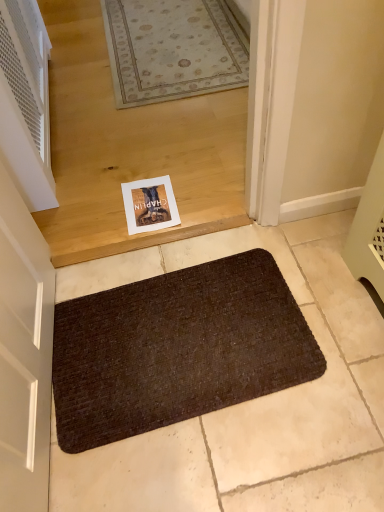
What are the coordinates of `vacant location below brown textured bath mat at lower center (from a real-world perspective)` in the screenshot? It's located at pos(173,337).